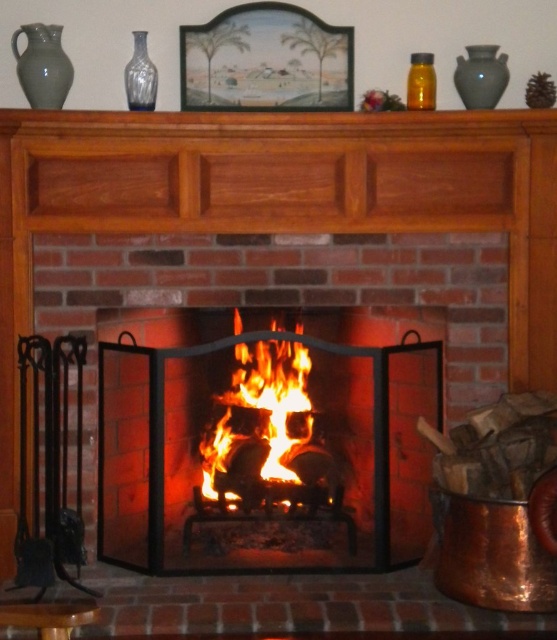
Who is more distant from viewer, [299,464] or [429,81]?

Positioned behind is point [299,464].

Does point (315, 444) come in front of point (418, 97)?

No, (315, 444) is behind (418, 97).

Is point (320, 323) farther from camera compared to point (411, 108)?

Yes, it is.

The image size is (557, 640). Identify the location of black metal fireplace at center. (266, 444).

Image resolution: width=557 pixels, height=640 pixels. I want to click on black metal fireplace at center, so click(266, 444).

Does black metal fireplace at center have a greater height compared to flaming wood at center?

Yes.

The image size is (557, 640). What are the coordinates of `black metal fireplace at center` in the screenshot? It's located at (266, 444).

Identify the location of black metal fireplace at center. click(x=266, y=444).

Does matte gray vase at upper left have a lesser width compared to matte gray vase at upper right?

No.

Does matte gray vase at upper left have a smaller size compared to matte gray vase at upper right?

Actually, matte gray vase at upper left might be larger than matte gray vase at upper right.

Is point (32, 61) closer to viewer compared to point (485, 76)?

Yes, point (32, 61) is in front of point (485, 76).

Find the location of a particular element. The height and width of the screenshot is (640, 557). matte gray vase at upper left is located at coordinates (42, 65).